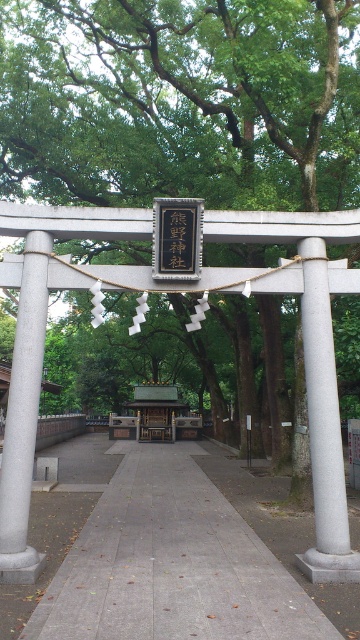
You are a gardener planning to place a 20 feet long decorative fence between the green leafy tree at center and the gray concrete pavement at center. Can the fence fit in the space between them?

The distance between the green leafy tree at center and the gray concrete pavement at center is 25.10 feet, which is longer than the 20 feet length of the fence. Therefore, the fence can fit between them with some space remaining.

You are a visitor at a Shinto shrine and want to know if the white stone pillar at right is wider than the gray concrete post at left. Can you confirm this based on the scene?

The white stone pillar at right is wider than the gray concrete post at left according to the scene description.

You are a gardener planning to plant a new tree in the garden. You need to know if there is enough space between the green leafy tree at center and the gray concrete pavement at center to place a 2 meter wide garden bed. Can you determine if there is sufficient space?

The green leafy tree at center might be wider than gray concrete pavement at center, so it is uncertain whether there is enough space for a 2 meter wide garden bed. Check the actual width of the tree and pavement before deciding.